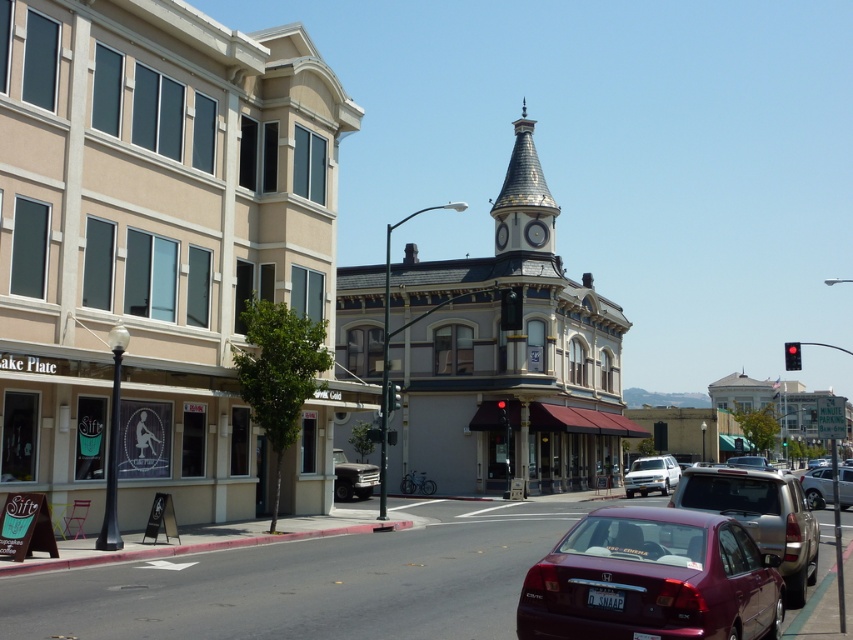
Is maroon metallic sedan at lower right shorter than black plastic traffic light at center?

Incorrect, maroon metallic sedan at lower right's height does not fall short of black plastic traffic light at center's.

Who is positioned more to the right, maroon metallic sedan at lower right or black plastic traffic light at center?

From the viewer's perspective, black plastic traffic light at center appears more on the right side.

Is point (697, 572) farther from camera compared to point (515, 321)?

No, (697, 572) is closer to viewer.

You are a GUI agent. You are given a task and a screenshot of the screen. Output one action in this format:
    pyautogui.click(x=<x>, y=<y>)
    Task: Click on the maroon metallic sedan at lower right
    
    Given the screenshot: What is the action you would take?
    pyautogui.click(x=653, y=580)

Between maroon metallic sedan at lower right and gold textured clock tower at upper center, which one appears on the left side from the viewer's perspective?

Positioned to the left is maroon metallic sedan at lower right.

Does maroon metallic sedan at lower right appear on the left side of gold textured clock tower at upper center?

Yes, maroon metallic sedan at lower right is to the left of gold textured clock tower at upper center.

The width and height of the screenshot is (853, 640). What do you see at coordinates (653, 580) in the screenshot? I see `maroon metallic sedan at lower right` at bounding box center [653, 580].

Identify the location of maroon metallic sedan at lower right. coord(653,580).

Who is shorter, satin silver sedan at center or green glass traffic light at center?

With less height is green glass traffic light at center.

Which is in front, point (813, 508) or point (396, 392)?

Point (396, 392) is more forward.

Where is `satin silver sedan at center`? The width and height of the screenshot is (853, 640). satin silver sedan at center is located at coordinates 817,486.

Where is `satin silver sedan at center`? satin silver sedan at center is located at coordinates (817, 486).